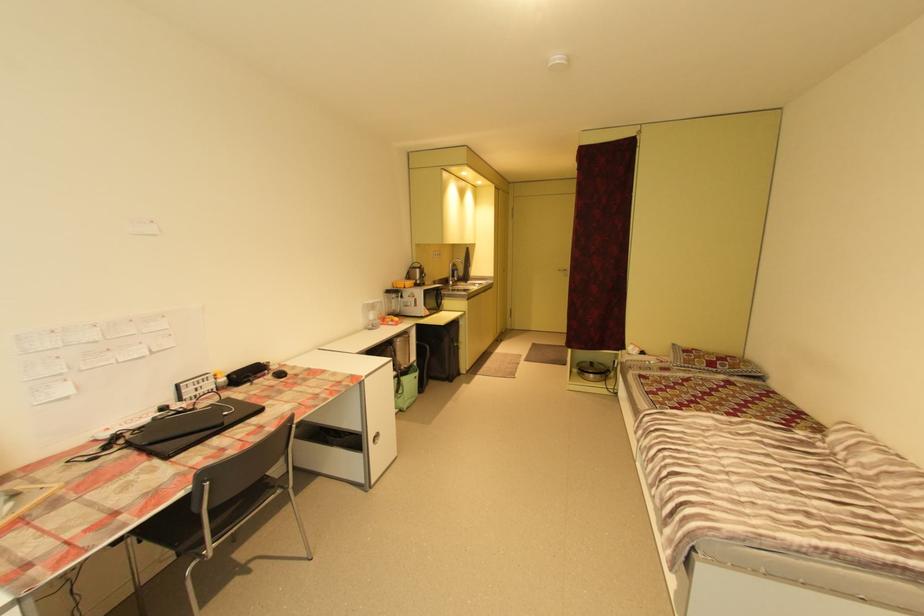
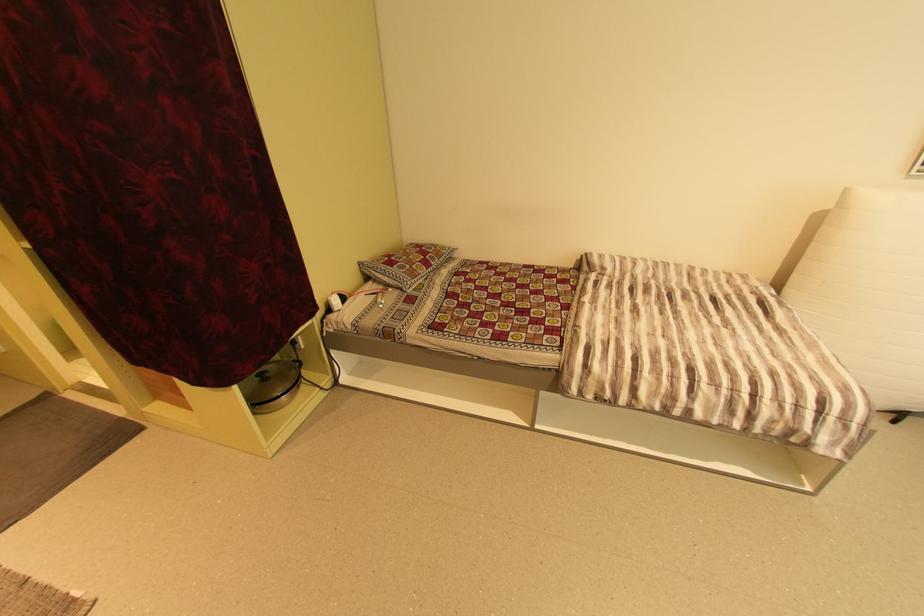
The point at [702,360] is marked in the first image. Where is the corresponding point in the second image?

(420, 267)